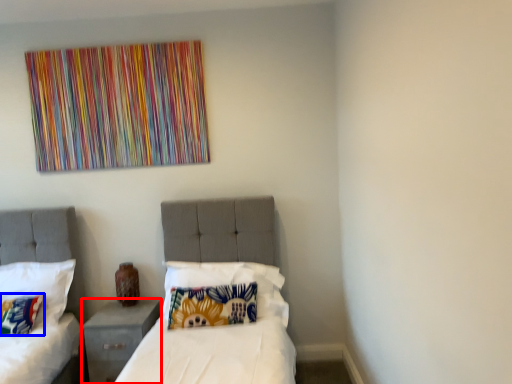
Question: Which of the following is the closest to the observer, nightstand (highlighted by a red box) or pillow (highlighted by a blue box)?

Choices:
 (A) nightstand
 (B) pillow

Answer: (B)